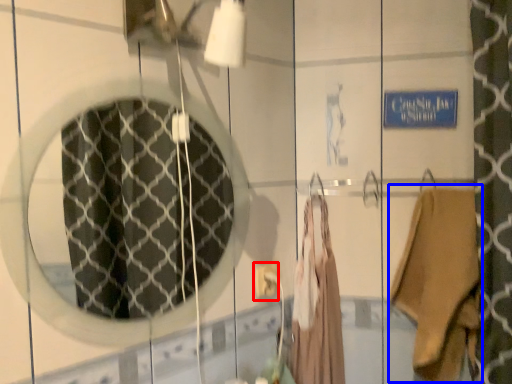
Question: Which object is closer to the camera taking this photo, electric outlet (highlighted by a red box) or clothing (highlighted by a blue box)?

Choices:
 (A) electric outlet
 (B) clothing

Answer: (B)